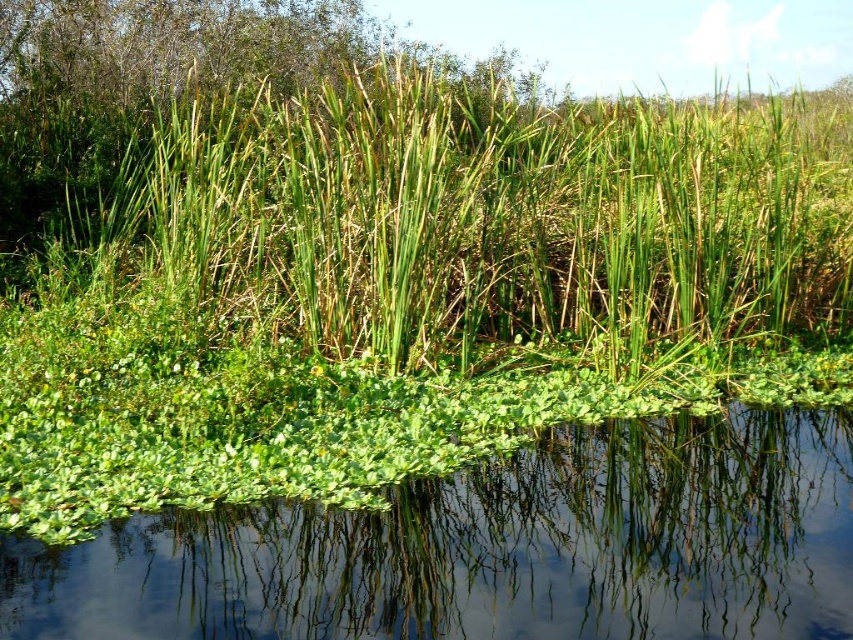
Is point (76, 276) farther from viewer compared to point (737, 464)?

Yes, it is.

Is green grass at center above green leafy water at center?

Indeed, green grass at center is positioned over green leafy water at center.

The width and height of the screenshot is (853, 640). What do you see at coordinates (480, 214) in the screenshot?
I see `green grass at center` at bounding box center [480, 214].

At what (x,y) coordinates should I click in order to perform the action: click on green grass at center. Please return your answer as a coordinate pair (x, y). Looking at the image, I should click on (480, 214).